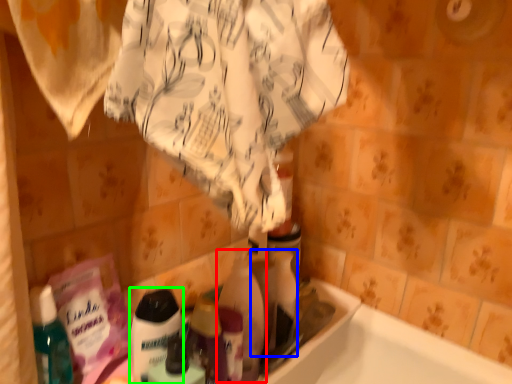
Question: Which object is the farthest from cleaning product (highlighted by a red box)? Choose among these: cleaning product (highlighted by a blue box) or cleaning product (highlighted by a green box).

Choices:
 (A) cleaning product
 (B) cleaning product

Answer: (B)